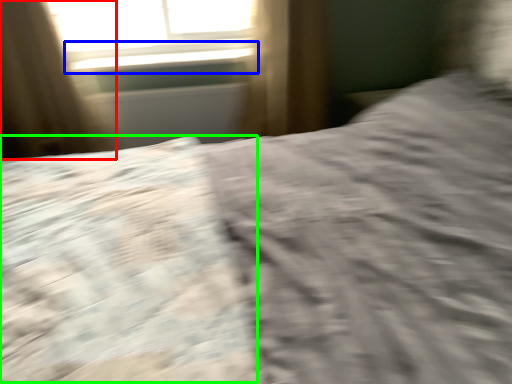
Question: Which is farther away from curtain (highlighted by a red box)? window sill (highlighted by a blue box) or sheet (highlighted by a green box)?

Choices:
 (A) window sill
 (B) sheet

Answer: (B)